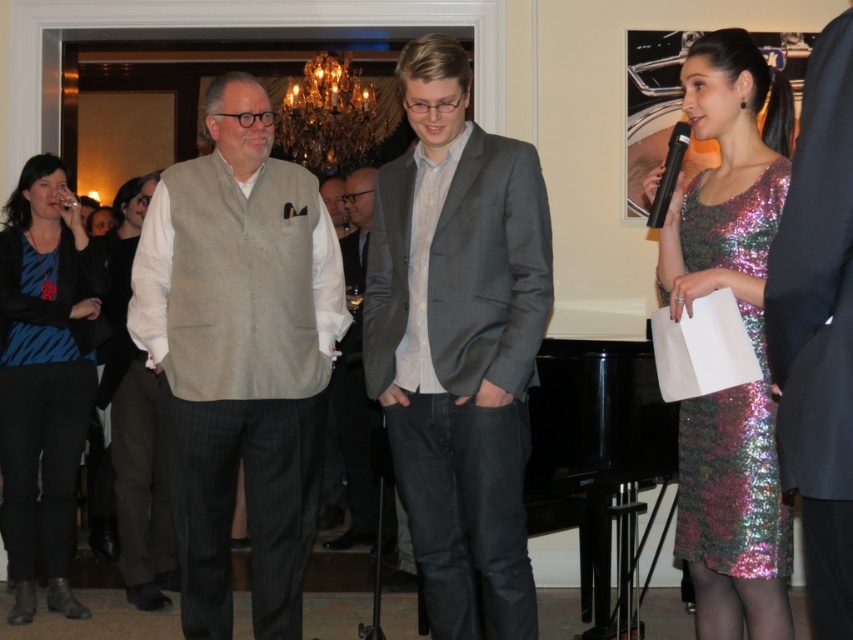
Question: Which point is farther to the camera?

Choices:
 (A) black wool suit at right
 (B) shiny sequined dress at center

Answer: (B)

Question: Which point appears closest to the camera in this image?

Choices:
 (A) (131, 538)
 (B) (337, 184)
 (C) (786, 164)

Answer: (C)

Question: Considering the relative positions of light beige wool vest at center and zebra print sweater at left in the image provided, where is light beige wool vest at center located with respect to zebra print sweater at left?

Choices:
 (A) right
 (B) left

Answer: (A)

Question: Can you confirm if black wool suit at right is smaller than light gray wool vest at center?

Choices:
 (A) yes
 (B) no

Answer: (A)

Question: Among these objects, which one is nearest to the camera?

Choices:
 (A) light brown textured blazer at center
 (B) holographic sequin dress at right

Answer: (B)

Question: Is gray fabric suit at center bigger than holographic sequin dress at right?

Choices:
 (A) no
 (B) yes

Answer: (B)